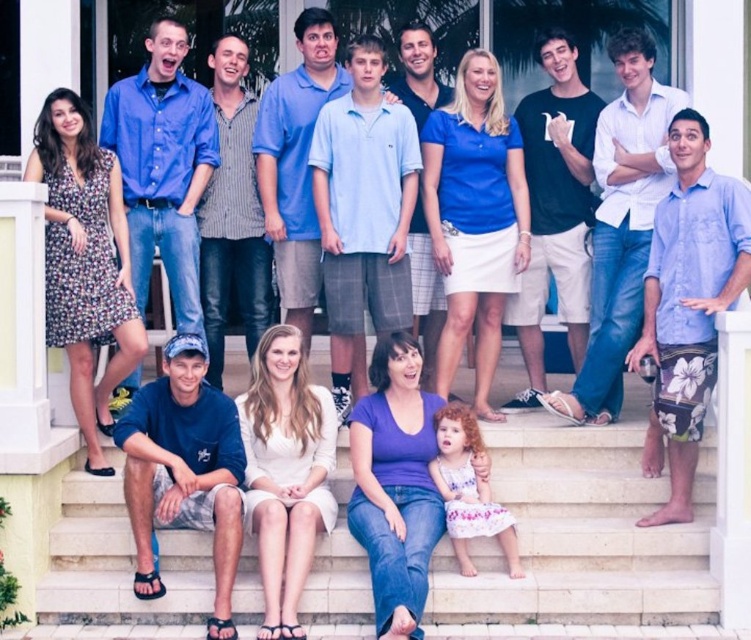
Does white stone stairs at lower center appear over blue button-down shirt at upper left?

No, white stone stairs at lower center is not above blue button-down shirt at upper left.

Does white stone stairs at lower center have a greater width compared to blue button-down shirt at upper left?

Yes.

The width and height of the screenshot is (751, 640). I want to click on white stone stairs at lower center, so click(581, 536).

I want to click on white stone stairs at lower center, so click(581, 536).